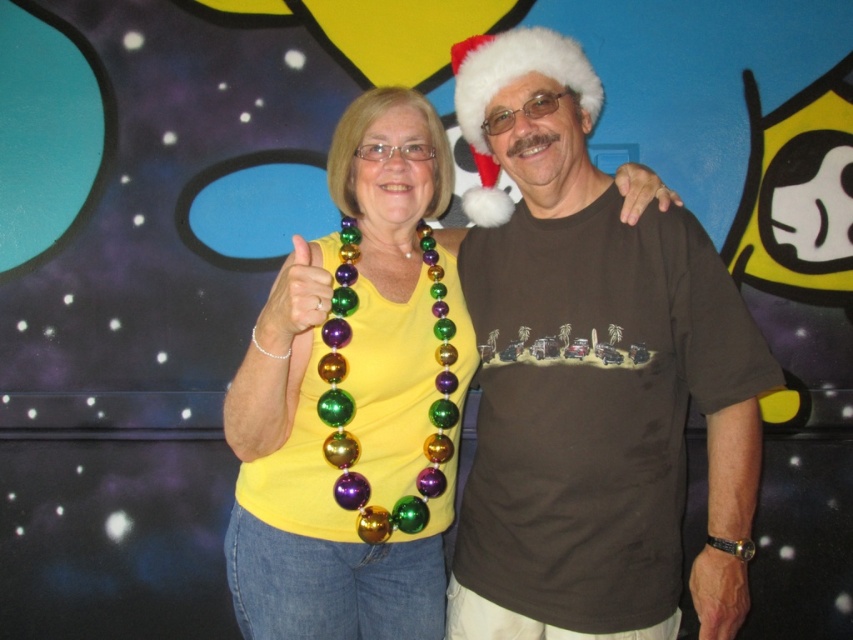
Does brown cotton t-shirt at center have a lesser width compared to yellow matte shirt at center?

Incorrect, brown cotton t-shirt at center's width is not less than yellow matte shirt at center's.

Describe the element at coordinates (592, 380) in the screenshot. The image size is (853, 640). I see `brown cotton t-shirt at center` at that location.

Where is `brown cotton t-shirt at center`? The height and width of the screenshot is (640, 853). brown cotton t-shirt at center is located at coordinates (592, 380).

Where is `brown cotton t-shirt at center`? brown cotton t-shirt at center is located at coordinates click(x=592, y=380).